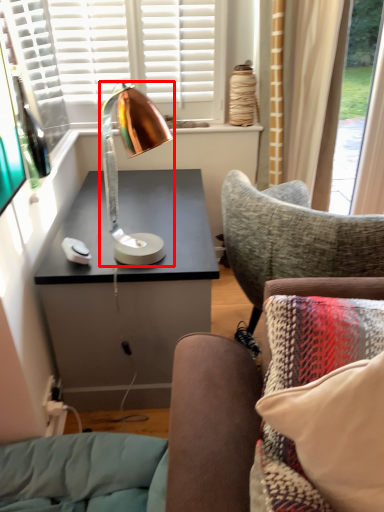
Question: Considering the relative positions of lamp (annotated by the red box) and pillow in the image provided, where is lamp (annotated by the red box) located with respect to the staircase?

Choices:
 (A) left
 (B) right

Answer: (A)